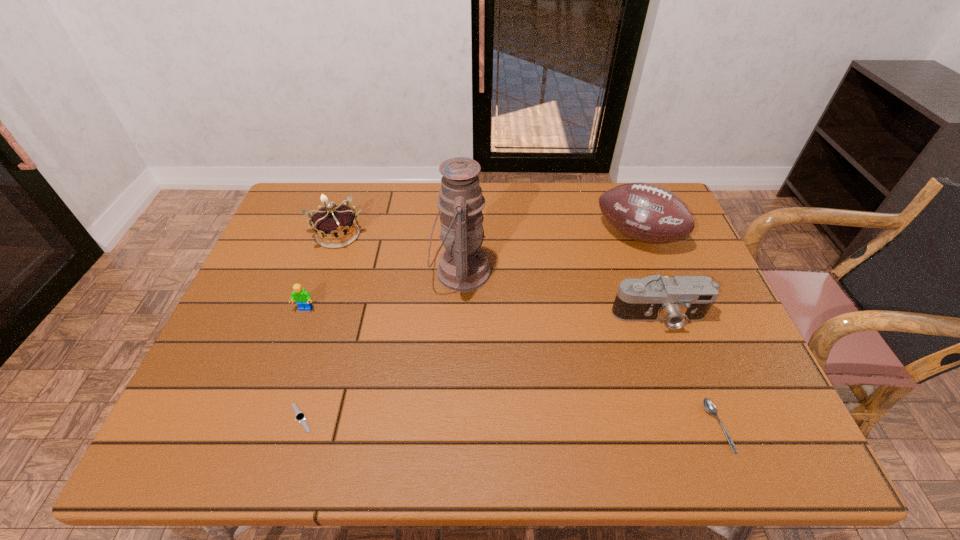
Locate an element on the screen. The image size is (960, 540). oil lamp is located at coordinates (463, 267).

The width and height of the screenshot is (960, 540). I want to click on the tallest object, so click(x=463, y=267).

The height and width of the screenshot is (540, 960). Identify the location of football (American). (644, 212).

What are the coordinates of `crown` in the screenshot? It's located at (335, 226).

The height and width of the screenshot is (540, 960). I want to click on camera, so click(x=675, y=301).

The height and width of the screenshot is (540, 960). In order to click on Lego in this screenshot , I will do `click(301, 296)`.

This screenshot has height=540, width=960. I want to click on soupspoon, so (x=709, y=406).

Locate an element on the screen. The width and height of the screenshot is (960, 540). watch is located at coordinates (300, 416).

This screenshot has height=540, width=960. I want to click on vacant space situated on the front of the tallest object, so click(x=458, y=339).

Locate an element on the screen. This screenshot has width=960, height=540. vacant space situated 0.270m on the front of the second tallest object is located at coordinates (675, 335).